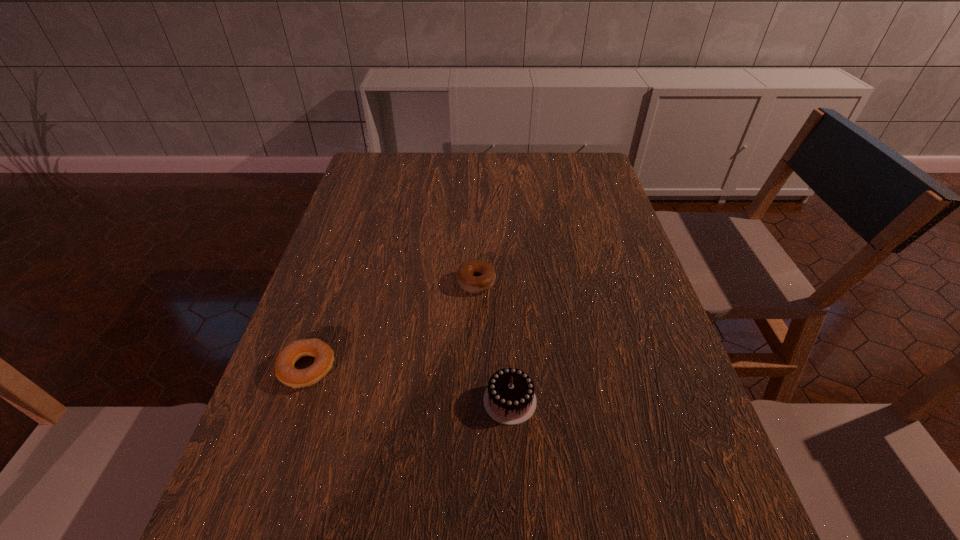
Identify the location of the tallest object. The width and height of the screenshot is (960, 540). (509, 399).

Locate an element on the screen. the farther bagel is located at coordinates (474, 276).

Locate an element on the screen. the farthest object is located at coordinates (474, 276).

Find the location of a particular element. Image resolution: width=960 pixels, height=540 pixels. the leftmost object is located at coordinates (285, 371).

What are the coordinates of `the left bagel` in the screenshot? It's located at (285, 371).

You are a GUI agent. You are given a task and a screenshot of the screen. Output one action in this format:
    pyautogui.click(x=<x>, y=<y>)
    Task: Click on the blank space located on the back of the chocolate cake
    Image resolution: width=960 pixels, height=540 pixels.
    Given the screenshot: What is the action you would take?
    pyautogui.click(x=505, y=308)

Identify the location of vacant area located 0.200m on the front of the right bagel. (476, 363).

You are a GUI agent. You are given a task and a screenshot of the screen. Output one action in this format:
    pyautogui.click(x=<x>, y=<y>)
    Task: Click on the free spot located on the front of the leftmost object
    This screenshot has width=960, height=540.
    Given the screenshot: What is the action you would take?
    pyautogui.click(x=269, y=477)

Where is `object at the left edge`? object at the left edge is located at coordinates (285, 371).

In the image, there is a desktop. Identify the location of free region at the far edge. The width and height of the screenshot is (960, 540). (504, 179).